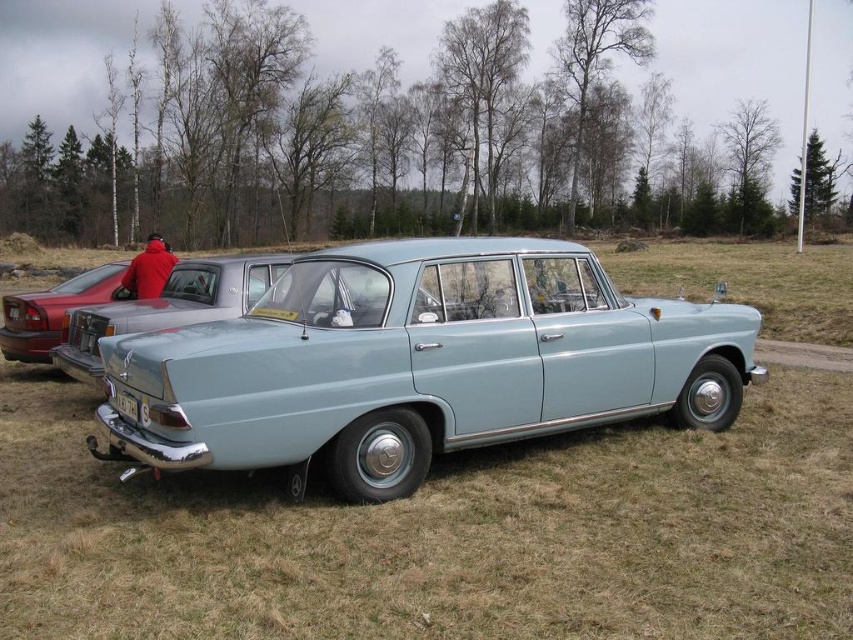
Between point (38, 301) and point (148, 237), which one is positioned behind?

Point (148, 237)

Locate an element on the screen. Image resolution: width=853 pixels, height=640 pixels. matte black car at left is located at coordinates (51, 310).

Does light blue metallic car at center have a smaller size compared to matte black car at left?

Correct, light blue metallic car at center occupies less space than matte black car at left.

Between light blue metallic car at center and matte black car at left, which one has more height?

Standing taller between the two is matte black car at left.

Between point (258, 401) and point (9, 333), which one is positioned in front?

Point (258, 401)

The height and width of the screenshot is (640, 853). In order to click on light blue metallic car at center in this screenshot , I will do `click(418, 364)`.

Can you confirm if light blue matte sedan at center is positioned above red fabric jacket at rear?

No.

What do you see at coordinates (167, 307) in the screenshot? I see `light blue matte sedan at center` at bounding box center [167, 307].

You are a GUI agent. You are given a task and a screenshot of the screen. Output one action in this format:
    pyautogui.click(x=<x>, y=<y>)
    Task: Click on the light blue matte sedan at center
    Image resolution: width=853 pixels, height=640 pixels.
    Given the screenshot: What is the action you would take?
    pyautogui.click(x=167, y=307)